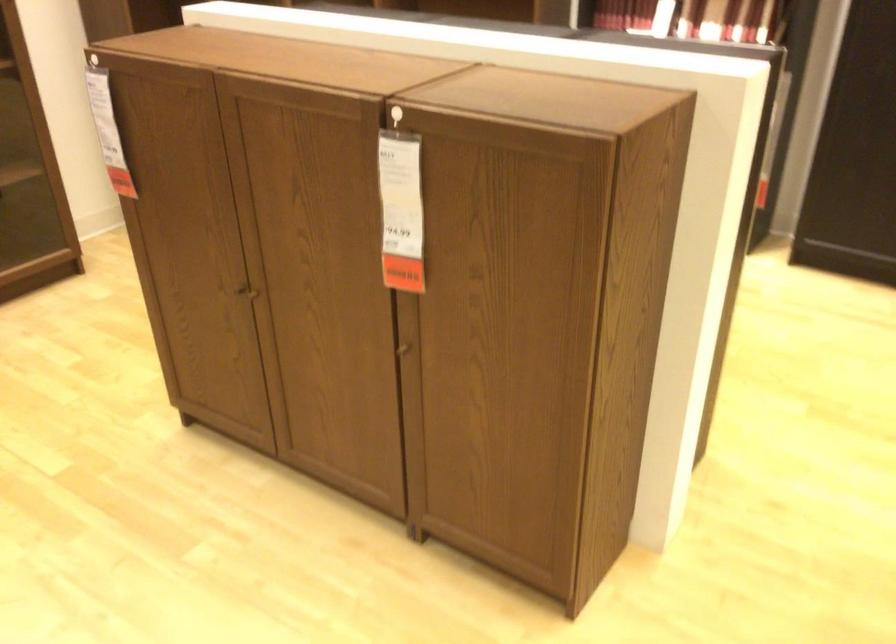
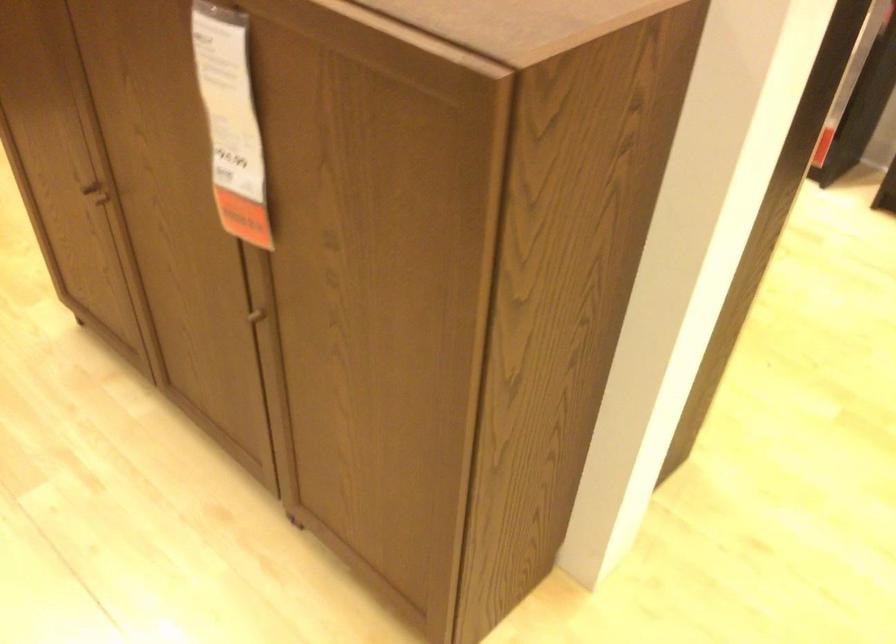
Where in the second image is the point corresponding to point 245,294 from the first image?

(95, 196)